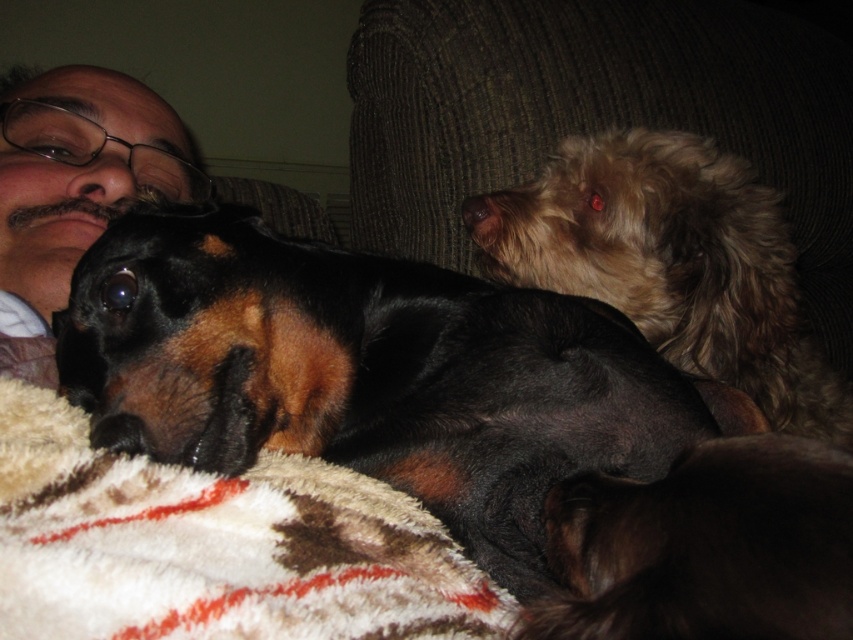
Does white plush blanket at lower left lie in front of fuzzy brown dog at upper right?

Yes.

Who is more distant from viewer, (x=28, y=508) or (x=711, y=269)?

Point (x=711, y=269)

You are a GUI agent. You are given a task and a screenshot of the screen. Output one action in this format:
    pyautogui.click(x=<x>, y=<y>)
    Task: Click on the white plush blanket at lower left
    
    Given the screenshot: What is the action you would take?
    pyautogui.click(x=210, y=540)

Identify the location of white plush blanket at lower left. The image size is (853, 640). (210, 540).

Between white plush blanket at lower left and black matte glasses at upper left, which one is positioned lower?

Positioned lower is white plush blanket at lower left.

Based on the photo, does white plush blanket at lower left have a lesser width compared to black matte glasses at upper left?

In fact, white plush blanket at lower left might be wider than black matte glasses at upper left.

Does point (509, 605) lie behind point (131, 124)?

No, (509, 605) is closer to viewer.

This screenshot has height=640, width=853. Identify the location of white plush blanket at lower left. (210, 540).

Is black fur dog at center to the left of fuzzy brown dog at upper right from the viewer's perspective?

Correct, you'll find black fur dog at center to the left of fuzzy brown dog at upper right.

Is black fur dog at center to the right of fuzzy brown dog at upper right from the viewer's perspective?

In fact, black fur dog at center is to the left of fuzzy brown dog at upper right.

Is point (398, 307) farther from camera compared to point (785, 342)?

No, (398, 307) is in front of (785, 342).

The image size is (853, 640). I want to click on black fur dog at center, so click(x=364, y=372).